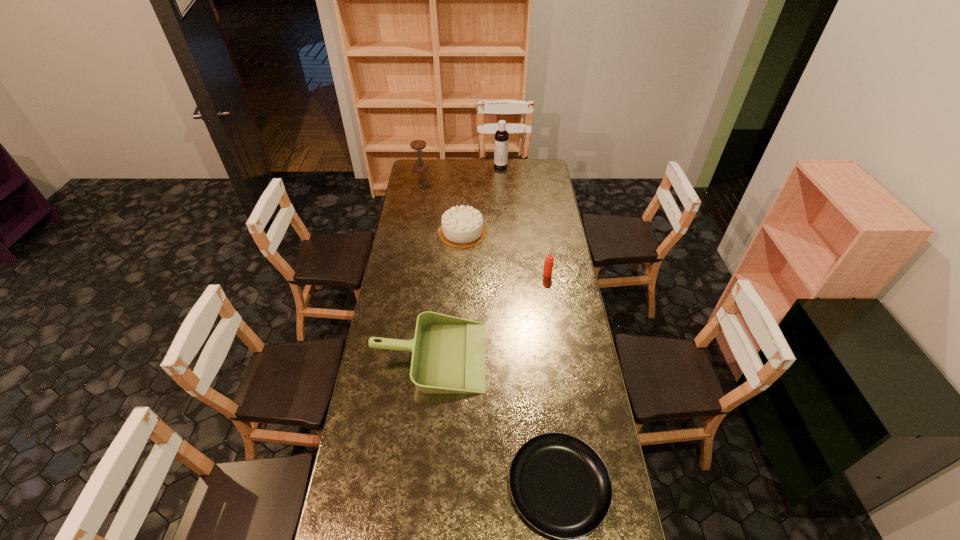
Identify the location of the tallest object. This screenshot has width=960, height=540. (501, 135).

Where is `hourglass`? The height and width of the screenshot is (540, 960). hourglass is located at coordinates (420, 166).

Find the location of a particular element. the third farthest object is located at coordinates (462, 226).

In order to click on Tabasco sauce in this screenshot , I will do `click(549, 260)`.

The width and height of the screenshot is (960, 540). In order to click on dustpan in this screenshot , I will do `click(448, 353)`.

Image resolution: width=960 pixels, height=540 pixels. What are the coordinates of `the second nearest object` in the screenshot? It's located at click(x=448, y=353).

The height and width of the screenshot is (540, 960). Identify the location of free space located 0.280m on the label side of the tallest object. (450, 166).

Image resolution: width=960 pixels, height=540 pixels. Identify the location of blank area located on the label side of the tallest object. (435, 166).

The width and height of the screenshot is (960, 540). I want to click on blank area located on the label side of the tallest object, so click(468, 166).

Where is `free space located 0.240m on the front of the hourglass`? free space located 0.240m on the front of the hourglass is located at coordinates 416,193.